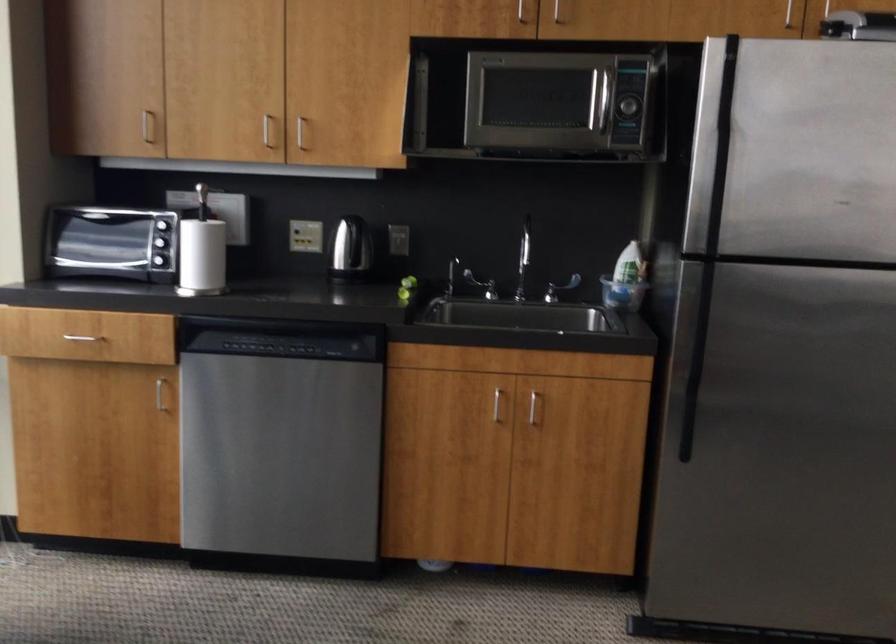
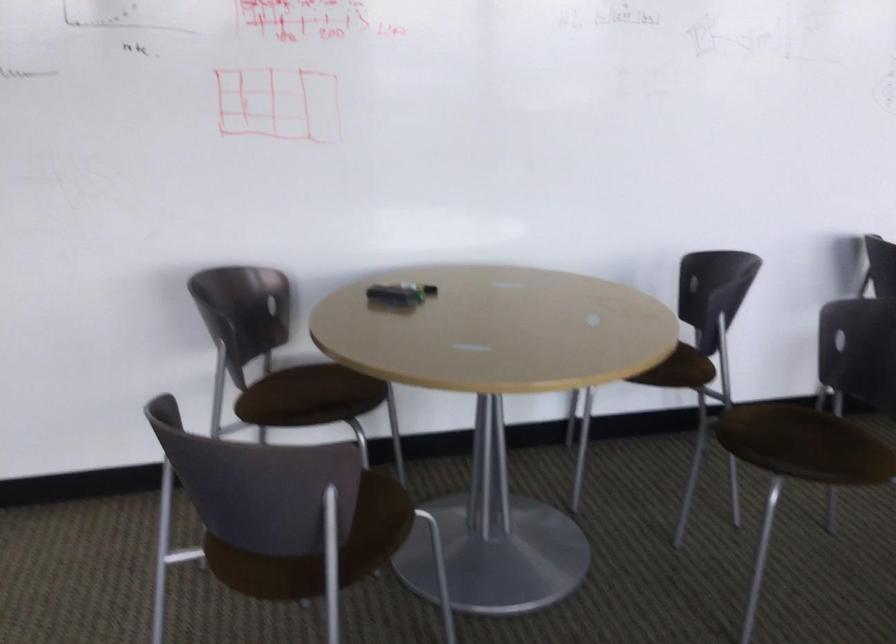
How did the camera likely rotate?

The rotation direction of the camera is right-down.